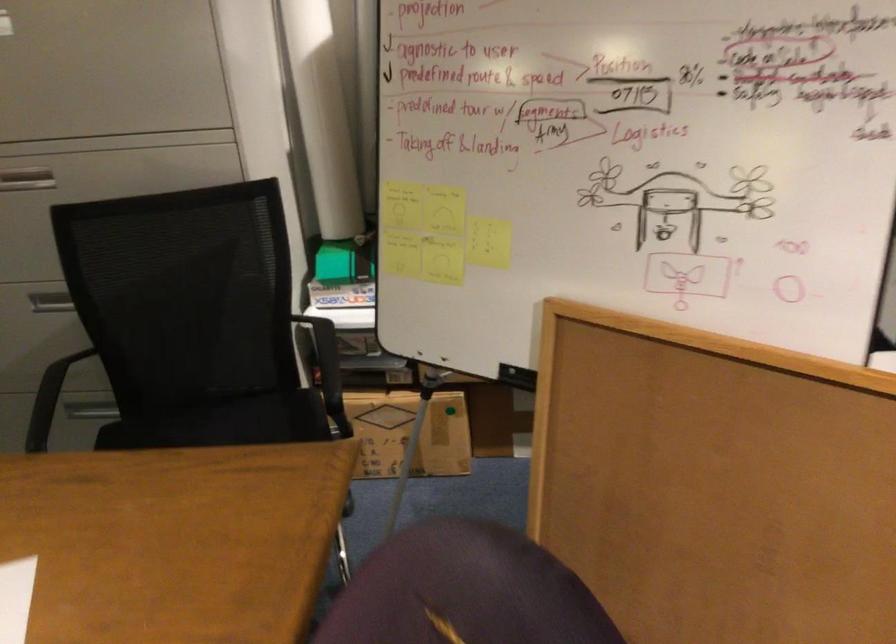
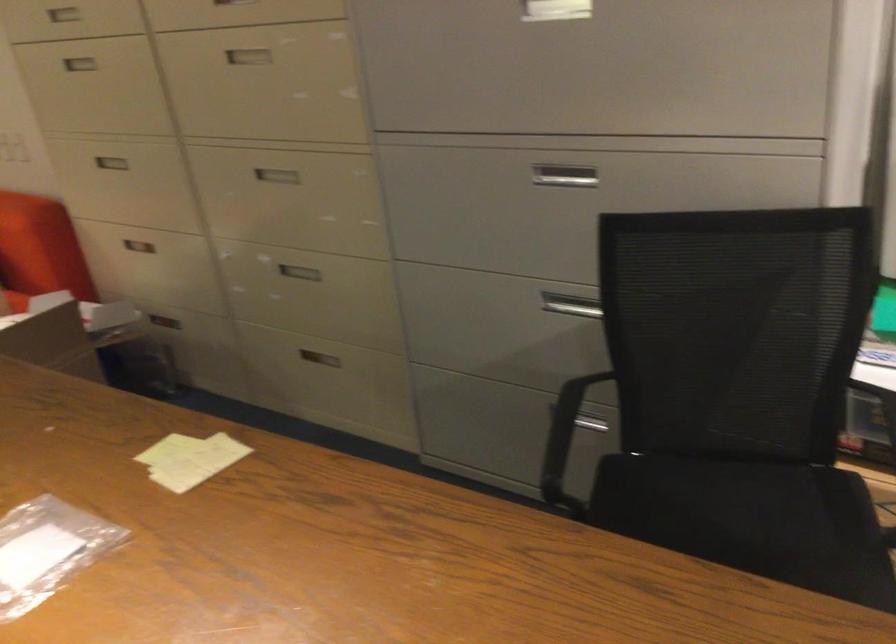
Question: The camera is either moving clockwise (left) or counter-clockwise (right) around the object. The first image is from the beginning of the video and the second image is from the end. Is the camera moving left or right when shooting the video?

Choices:
 (A) Left
 (B) Right

Answer: (B)